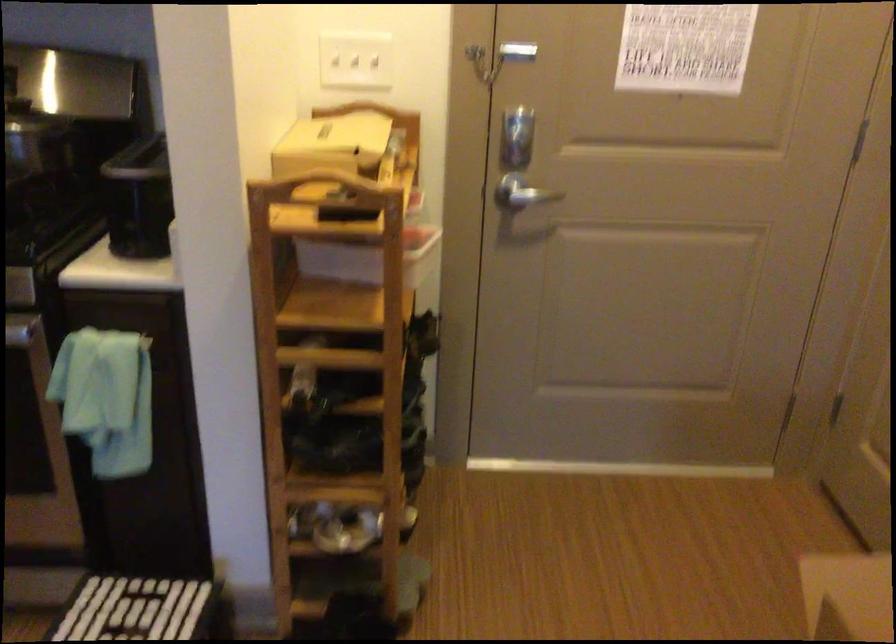
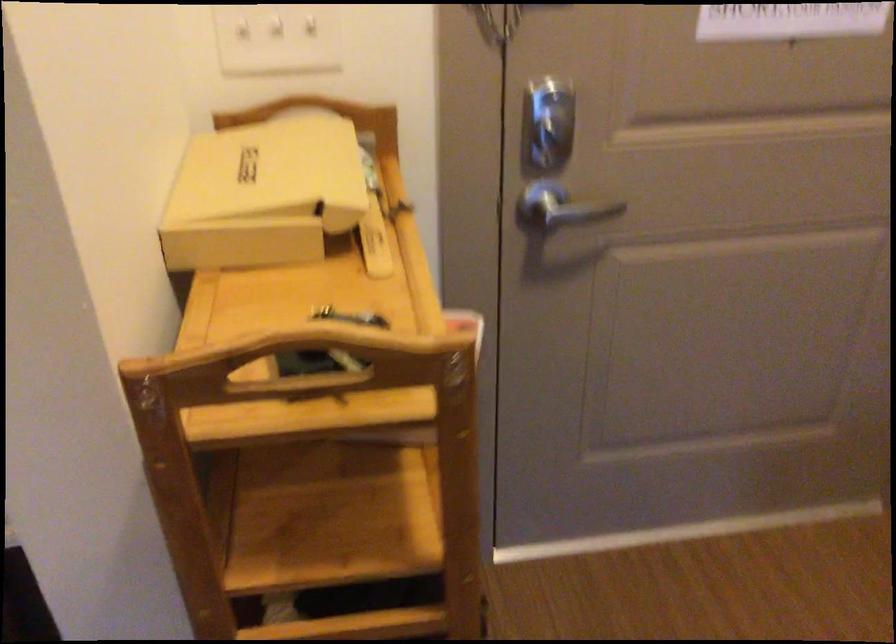
Question: Based on the continuous images, in which direction is the camera rotating? Reply with the corresponding letter.

Choices:
 (A) Left
 (B) Right
 (C) Up
 (D) Down

Answer: (B)